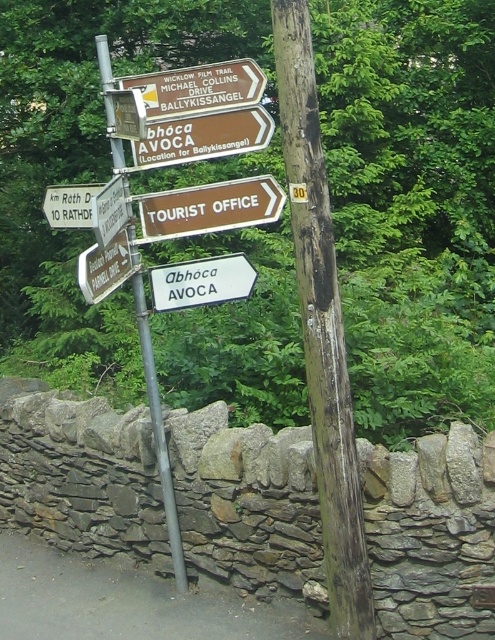
Question: From the image, what is the correct spatial relationship of brown wooden sign at upper center in relation to white plastic sign at center?

Choices:
 (A) above
 (B) below

Answer: (A)

Question: Which point is farther from the camera taking this photo?

Choices:
 (A) (211, 145)
 (B) (137, 298)
 (C) (72, 209)

Answer: (C)

Question: Can you confirm if wooden post at center is thinner than white plastic sign at upper left?

Choices:
 (A) no
 (B) yes

Answer: (A)

Question: Which of the following is the farthest from the observer?

Choices:
 (A) (82, 188)
 (B) (168, 484)

Answer: (B)

Question: Among these objects, which one is farthest from the camera?

Choices:
 (A) white plastic sign at center
 (B) brown wooden sign at upper center
 (C) metallic pole at upper center
 (D) brown wooden signpost at upper center

Answer: (A)

Question: Observing the image, what is the correct spatial positioning of brown wooden signpost at upper center in reference to metallic pole at upper center?

Choices:
 (A) below
 (B) above

Answer: (B)